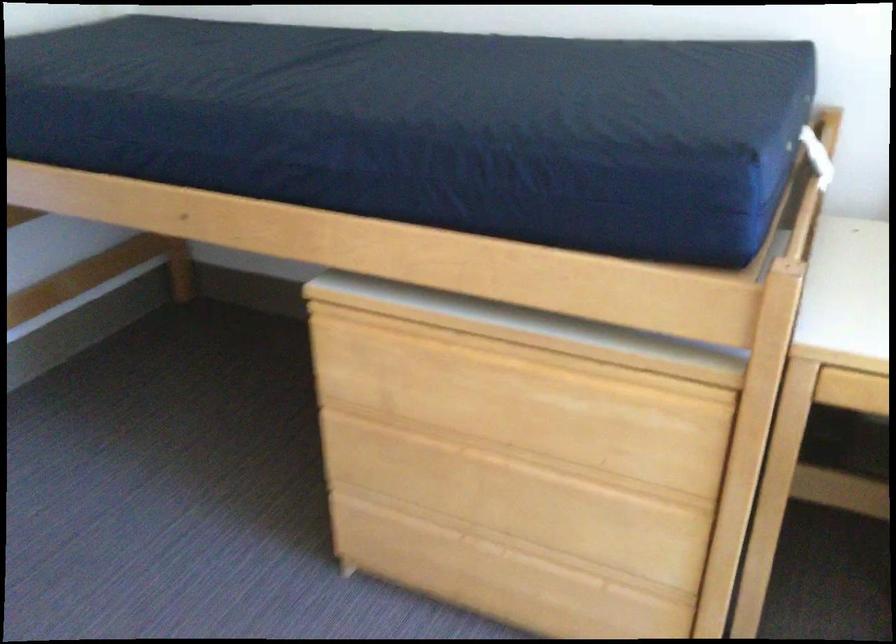
Find where to sitting on the mattress sitting surface. Please return your answer as a coordinate pair (x, y).

(401, 100)